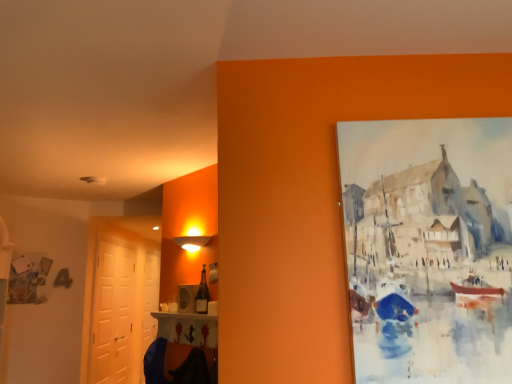
Question: Considering the relative positions of white matte door at left, acting as the second door starting from the back, and white glossy door at left, which is counted as the 1th door, starting from the back, in the image provided, is white matte door at left, acting as the second door starting from the back, to the left or to the right of white glossy door at left, which is counted as the 1th door, starting from the back,?

Choices:
 (A) right
 (B) left

Answer: (B)

Question: Is white matte door at left, acting as the second door starting from the back, spatially inside white glossy door at left, the second door when ordered from front to back, or outside of it?

Choices:
 (A) outside
 (B) inside

Answer: (A)

Question: Which of these objects is positioned closest to the matte glass bottle at center?

Choices:
 (A) white glossy door at left, the second door when ordered from front to back
 (B) white matte door at left, acting as the second door starting from the back

Answer: (A)

Question: Considering the real-world distances, which object is closest to the white matte door at left, the first door when ordered from front to back?

Choices:
 (A) white glossy door at left, which is counted as the 1th door, starting from the back
 (B) matte glass bottle at center

Answer: (A)